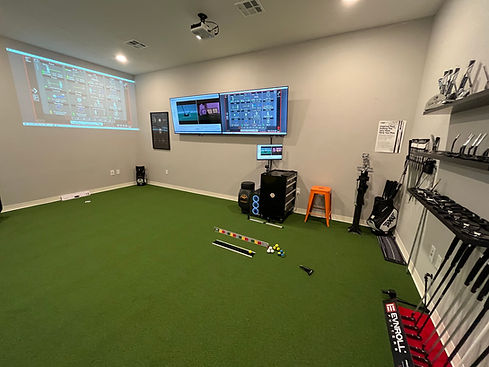
I want to click on black shelves, so click(x=472, y=162), click(x=480, y=95).